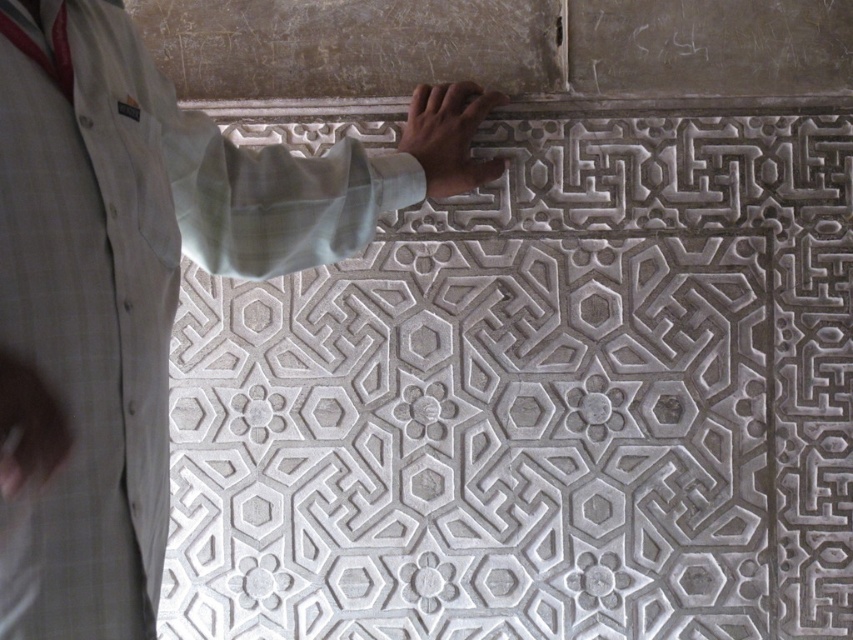
You are an art restorer examining the carved stone pattern at center and the matte gray hand at upper center. Which object is taller in the image?

The carved stone pattern at center is taller than the matte gray hand at upper center.

You are an art conservator examining the stone wall. You notice two hands touching the wall. Which hand, the light skin hand at center or the matte gray hand at upper center, is positioned to the right of the other?

The light skin hand at center is to the right of the matte gray hand at upper center.